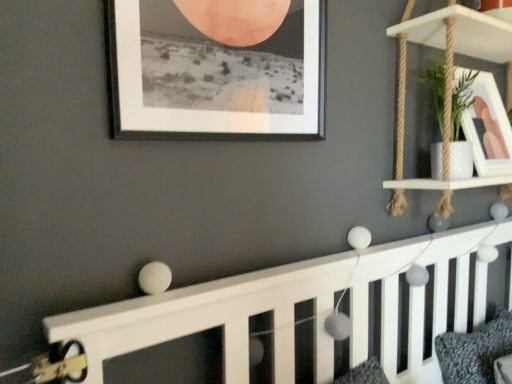
Question: From a real-world perspective, relative to white wood shelf at upper right, is black matte picture frame at upper center, positioned as the 1th picture frame in front-to-back order, vertically above or below?

Choices:
 (A) above
 (B) below

Answer: (A)

Question: Considering the positions of black matte picture frame at upper center, the first picture frame positioned from the left, and white wood shelf at upper right in the image, is black matte picture frame at upper center, the first picture frame positioned from the left, bigger or smaller than white wood shelf at upper right?

Choices:
 (A) big
 (B) small

Answer: (B)

Question: Which is farther from the white glossy picture frame at upper right, marked as the first picture frame in a back-to-front arrangement?

Choices:
 (A) textured gray pillow at lower right
 (B) black matte picture frame at upper center, the first picture frame positioned from the left
 (C) white wood shelf at upper right

Answer: (B)

Question: Estimate the real-world distances between objects in this image. Which object is farther from the black matte picture frame at upper center, which is the second picture frame from right to left?

Choices:
 (A) textured gray pillow at lower right
 (B) white wood shelf at upper right
 (C) white glossy picture frame at upper right, marked as the first picture frame in a back-to-front arrangement

Answer: (A)